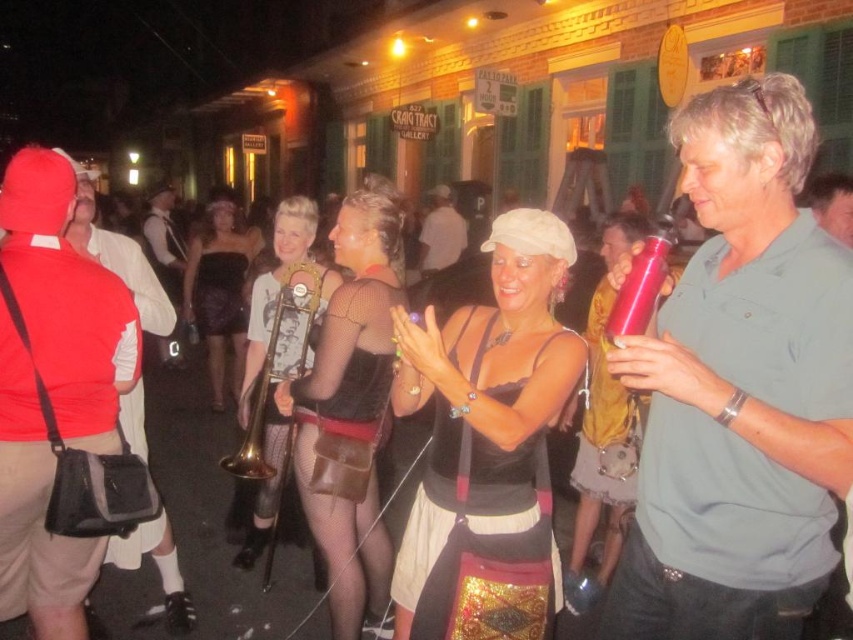
Is matte black tank top at center above matte black dress at center?

Correct, matte black tank top at center is located above matte black dress at center.

In the scene shown: Is matte black tank top at center below matte black dress at center?

No.

Between point (508, 333) and point (364, 563), which one is positioned in front?

Point (508, 333)

This screenshot has width=853, height=640. What are the coordinates of `matte black tank top at center` in the screenshot? It's located at (488, 444).

What do you see at coordinates (740, 388) in the screenshot? I see `matte red water bottle at center` at bounding box center [740, 388].

In the scene shown: Does matte red water bottle at center have a greater width compared to matte black tank top at center?

No, matte red water bottle at center is not wider than matte black tank top at center.

From the picture: Who is more forward, (657, 632) or (480, 486)?

Point (657, 632)

Find the location of a particular element. The width and height of the screenshot is (853, 640). matte red water bottle at center is located at coordinates (740, 388).

Which is in front, point (712, 618) or point (450, 236)?

Point (712, 618) is more forward.

Is matte red water bottle at center shorter than matte black hat at center?

In fact, matte red water bottle at center may be taller than matte black hat at center.

Image resolution: width=853 pixels, height=640 pixels. Find the location of `matte red water bottle at center`. matte red water bottle at center is located at coordinates (740, 388).